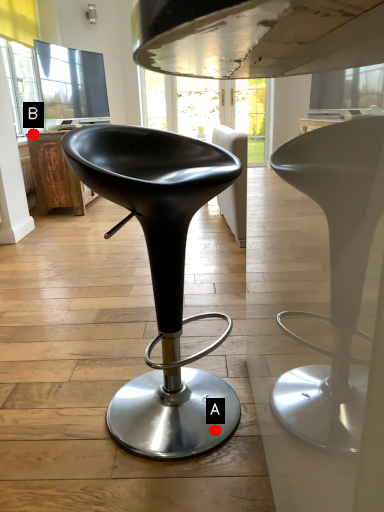
Question: Two points are circled on the image, labeled by A and B beside each circle. Which point is farther from the camera taking this photo?

Choices:
 (A) A is further
 (B) B is further

Answer: (B)